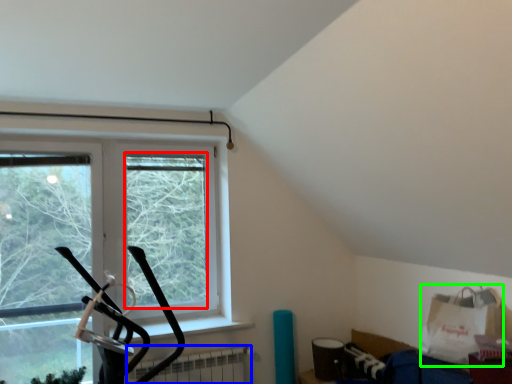
Question: Considering the real-world distances, which object is closest to window screen (highlighted by a red box)? radiator (highlighted by a blue box) or grocery bag (highlighted by a green box).

Choices:
 (A) radiator
 (B) grocery bag

Answer: (A)